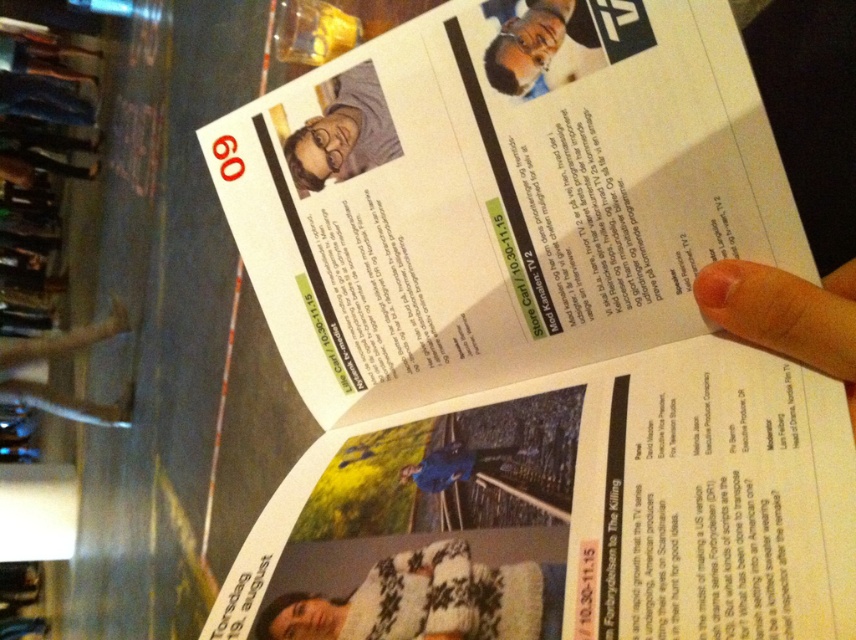
You are holding the brochure and notice two points marked on the page. The first point is at coordinate point (803,346) and the second is at point (314,186). From your perspective, which point is closer to you?

Point (803,346) is in front of point (314,186), so it is closer to you.